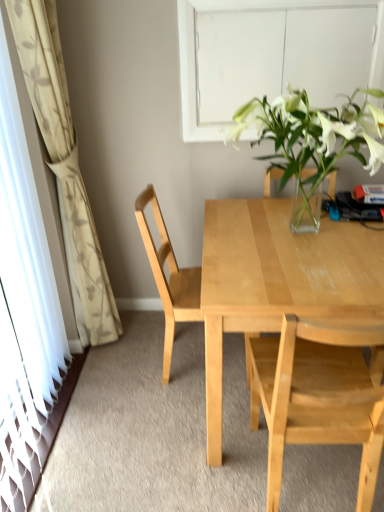
You are a GUI agent. You are given a task and a screenshot of the screen. Output one action in this format:
    pyautogui.click(x=<x>, y=<y>)
    Task: Click on the vacant space situated above light wood desk at center (from a real-world perspective)
    Image resolution: width=384 pixels, height=512 pixels.
    Given the screenshot: What is the action you would take?
    pyautogui.click(x=300, y=237)